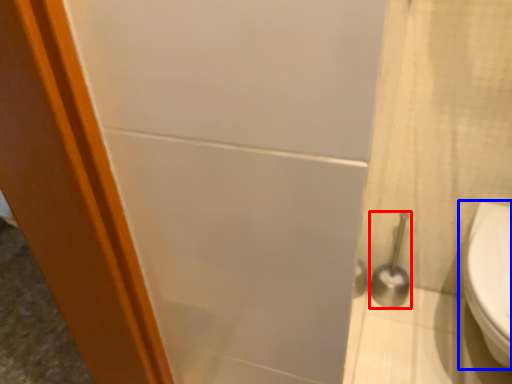
Question: Which object is further to the camera taking this photo, shower (highlighted by a red box) or toilet (highlighted by a blue box)?

Choices:
 (A) shower
 (B) toilet

Answer: (A)